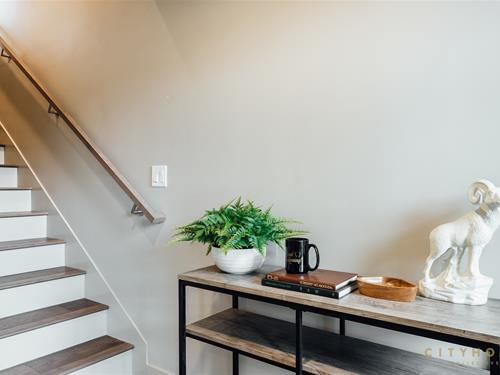
Find the location of `mug`. mug is located at coordinates (295, 258).